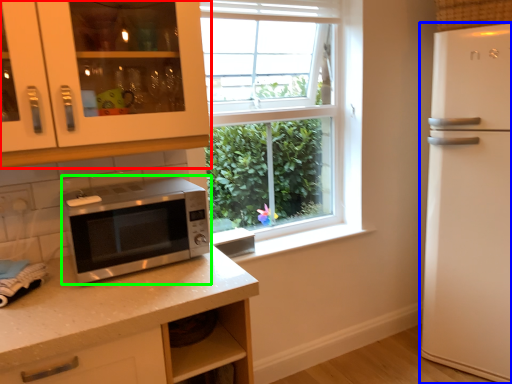
Question: Considering the real-world distances, which object is farthest from cabinetry (highlighted by a red box)? refrigerator (highlighted by a blue box) or microwave oven (highlighted by a green box)?

Choices:
 (A) refrigerator
 (B) microwave oven

Answer: (A)